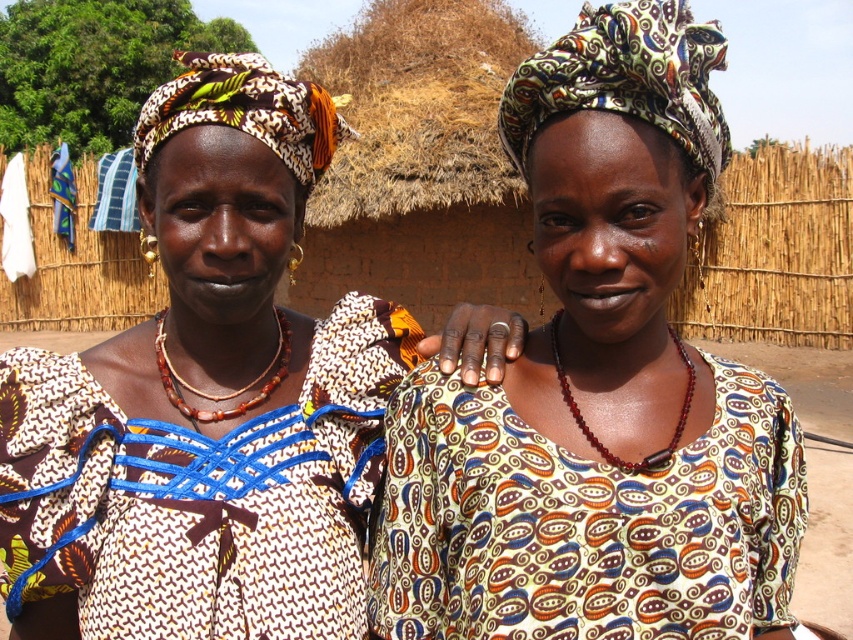
Question: Does printed fabric blouse at center appear on the right side of printed fabric dress at center?

Choices:
 (A) no
 (B) yes

Answer: (A)

Question: Which point is closer to the camera taking this photo?

Choices:
 (A) (260, 355)
 (B) (575, 621)
 (C) (451, 634)

Answer: (B)

Question: From the image, what is the correct spatial relationship of printed fabric blouse at center in relation to printed fabric dress at center?

Choices:
 (A) above
 (B) below

Answer: (A)

Question: Which point is farther from the camera taking this photo?

Choices:
 (A) (286, 400)
 (B) (642, 477)
 (C) (660, 10)

Answer: (A)

Question: Which of these objects is positioned farthest from the printed fabric headscarf at upper center?

Choices:
 (A) printed fabric blouse at center
 (B) printed fabric dress at center

Answer: (A)

Question: Can you confirm if printed fabric headscarf at upper center is positioned to the left of printed fabric dress at center?

Choices:
 (A) no
 (B) yes

Answer: (B)